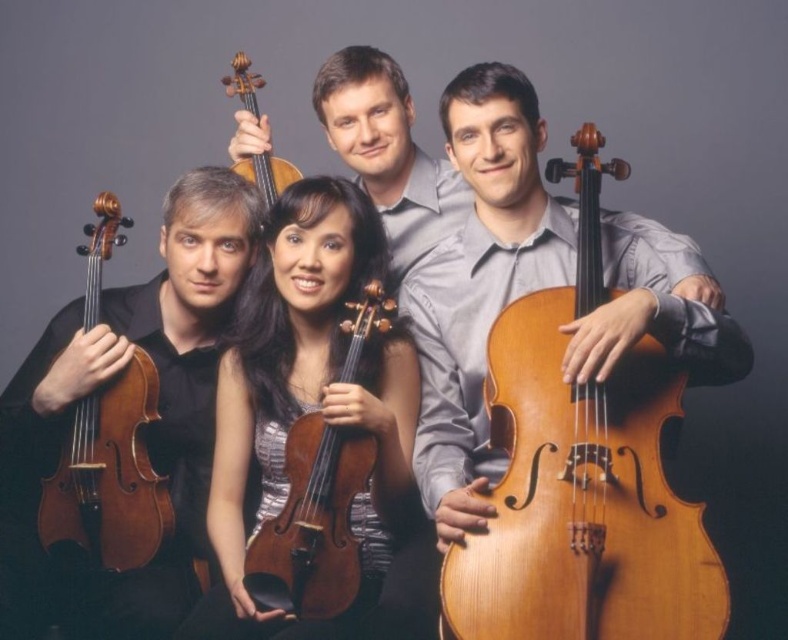
Who is positioned more to the right, matte black violin at left or wooden violin at center?

wooden violin at center

Does matte black violin at left appear over wooden violin at center?

Yes, matte black violin at left is above wooden violin at center.

Is point (121, 611) closer to camera compared to point (333, 596)?

No, it is not.

Where is `matte black violin at left`? This screenshot has height=640, width=788. matte black violin at left is located at coordinates (147, 428).

Which is behind, point (23, 628) or point (251, 77)?

The point (251, 77) is behind.

Between matte black violin at left and matte brown violin at upper center, which one is positioned higher?

matte brown violin at upper center is above.

Who is more forward, [214,301] or [251,88]?

Point [214,301]

Locate an element on the screen. The width and height of the screenshot is (788, 640). matte black violin at left is located at coordinates (147, 428).

Between point (307, 486) and point (243, 61), which one is positioned in front?

Point (307, 486)

What are the coordinates of `wooden violin at center` in the screenshot? It's located at (313, 524).